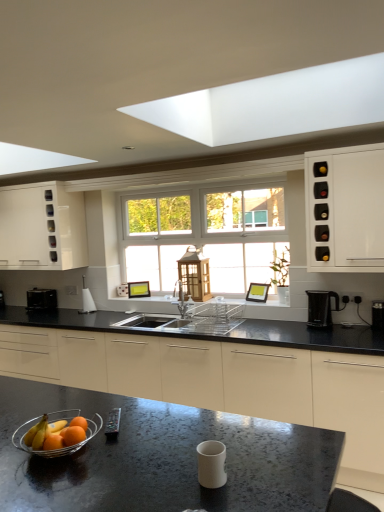
This screenshot has height=512, width=384. Find the location of `vacant space situated on the left part of black plastic coffee maker at right, which is the 1th appliance in right-to-left order`. vacant space situated on the left part of black plastic coffee maker at right, which is the 1th appliance in right-to-left order is located at coordinates (358, 328).